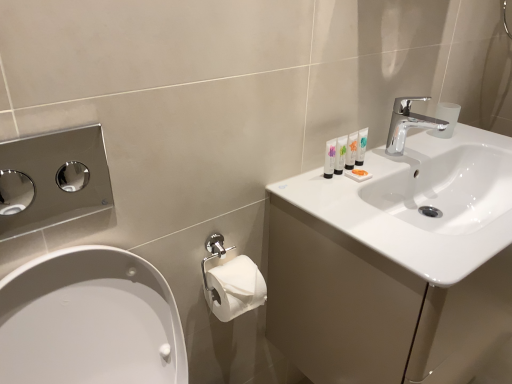
Question: Is white glossy sink at upper right positioned in front of polished chrome hand dryer at left?

Choices:
 (A) yes
 (B) no

Answer: (B)

Question: From the image's perspective, does white glossy sink at upper right appear lower than polished chrome hand dryer at left?

Choices:
 (A) yes
 (B) no

Answer: (A)

Question: Could you tell me if white glossy sink at upper right is turned towards polished chrome hand dryer at left?

Choices:
 (A) no
 (B) yes

Answer: (A)

Question: Is white glossy sink at upper right at the right side of polished chrome hand dryer at left?

Choices:
 (A) yes
 (B) no

Answer: (A)

Question: Can you confirm if white glossy sink at upper right is thinner than polished chrome hand dryer at left?

Choices:
 (A) yes
 (B) no

Answer: (B)

Question: Do you think white glossy tubes at upper right, the first mouthwash when ordered from left to right, is within chrome metallic faucet at upper right, or outside of it?

Choices:
 (A) inside
 (B) outside

Answer: (B)

Question: Considering the positions of white glossy tubes at upper right, the first mouthwash when ordered from left to right, and chrome metallic faucet at upper right in the image, is white glossy tubes at upper right, the first mouthwash when ordered from left to right, wider or thinner than chrome metallic faucet at upper right?

Choices:
 (A) thin
 (B) wide

Answer: (A)

Question: Based on their positions, is white glossy tubes at upper right, the first mouthwash when ordered from left to right, located to the left or right of chrome metallic faucet at upper right?

Choices:
 (A) left
 (B) right

Answer: (A)

Question: From the image's perspective, is white glossy tubes at upper right, which ranks as the 4th mouthwash in right-to-left order, positioned above or below chrome metallic faucet at upper right?

Choices:
 (A) above
 (B) below

Answer: (B)

Question: From a real-world perspective, is translucent plastic tubes at upper right, arranged as the 1th mouthwash when viewed from the right, physically located above or below polished chrome hand dryer at left?

Choices:
 (A) above
 (B) below

Answer: (B)

Question: Considering the positions of translucent plastic tubes at upper right, placed as the 4th mouthwash when sorted from left to right, and polished chrome hand dryer at left in the image, is translucent plastic tubes at upper right, placed as the 4th mouthwash when sorted from left to right, bigger or smaller than polished chrome hand dryer at left?

Choices:
 (A) small
 (B) big

Answer: (A)

Question: Choose the correct answer: Is translucent plastic tubes at upper right, placed as the 4th mouthwash when sorted from left to right, inside polished chrome hand dryer at left or outside it?

Choices:
 (A) outside
 (B) inside

Answer: (A)

Question: From the image's perspective, is translucent plastic tubes at upper right, placed as the 4th mouthwash when sorted from left to right, above or below polished chrome hand dryer at left?

Choices:
 (A) below
 (B) above

Answer: (B)

Question: From their relative heights in the image, would you say white glossy tube at upper right, which is the 3th mouthwash in left-to-right order, is taller or shorter than translucent plastic tubes at upper right, placed as the 4th mouthwash when sorted from left to right?

Choices:
 (A) tall
 (B) short

Answer: (B)

Question: Is white glossy tube at upper right, which is the 3th mouthwash in left-to-right order, inside or outside of translucent plastic tubes at upper right, placed as the 4th mouthwash when sorted from left to right?

Choices:
 (A) inside
 (B) outside

Answer: (B)